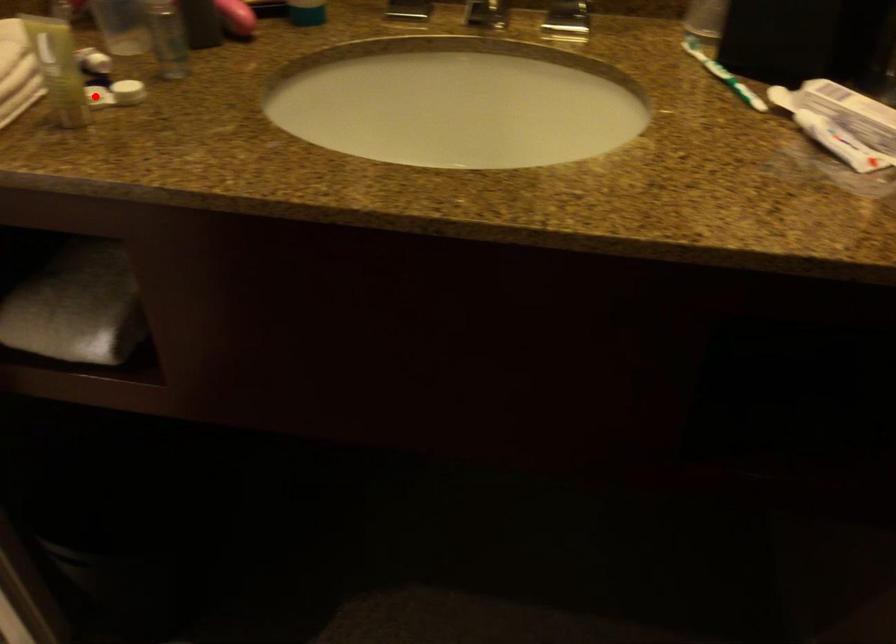
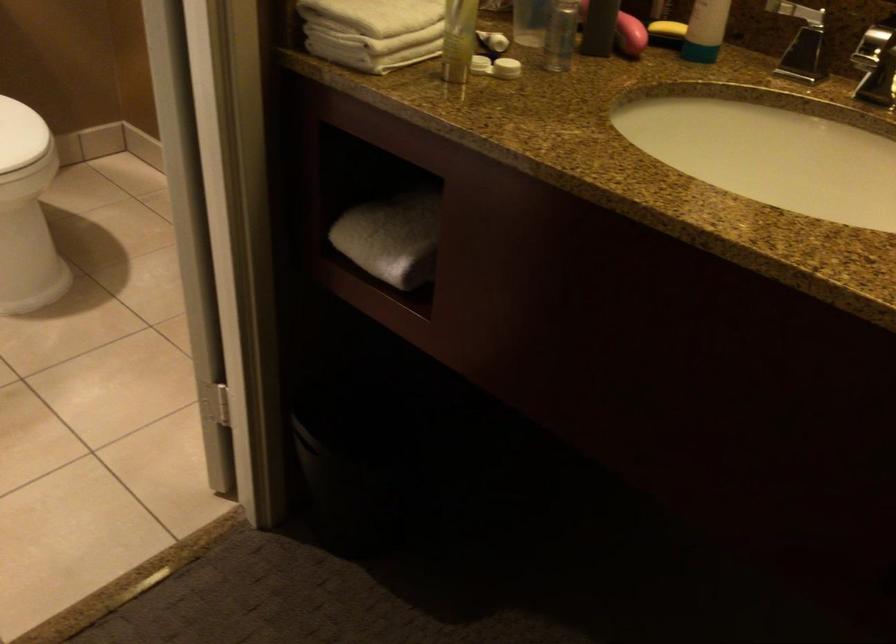
Question: I am providing you with two images of the same scene from different viewpoints. Image1 has a red point marked. In image2, the corresponding 3D location appears at what relative position? Reply with the corresponding letter.

Choices:
 (A) Closer
 (B) Farther

Answer: (B)